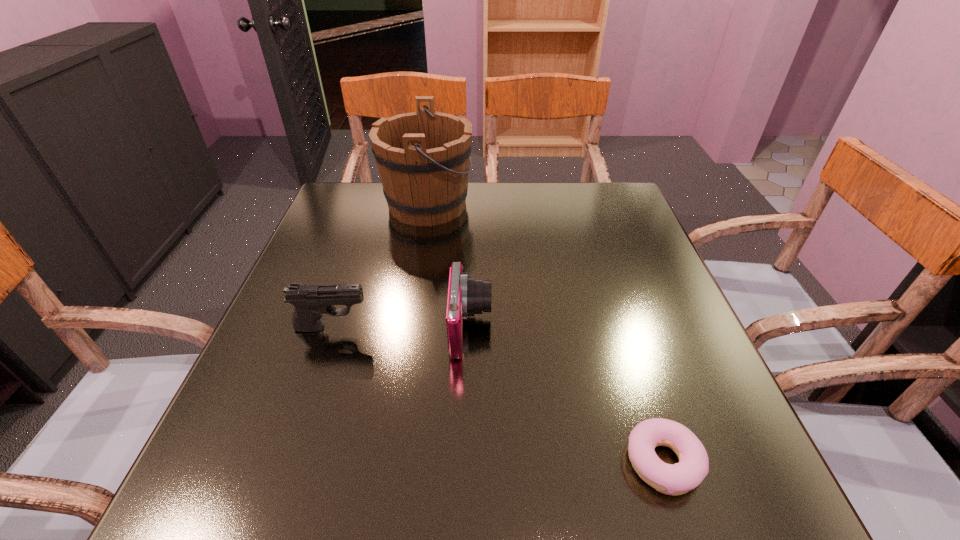
This screenshot has width=960, height=540. I want to click on vacant position in the image that satisfies the following two spatial constraints: 1. at the barrel of the shortest object; 2. on the left side of the pistol, so click(x=286, y=462).

Identify the location of vacant space that satisfies the following two spatial constraints: 1. on the front-facing side of the nearest object; 2. on the left side of the camera. This screenshot has width=960, height=540. (468, 462).

Image resolution: width=960 pixels, height=540 pixels. I want to click on free space that satisfies the following two spatial constraints: 1. at the barrel of the pistol; 2. on the right side of the nearest object, so click(x=286, y=462).

At what (x,y) coordinates should I click in order to perform the action: click on free space that satisfies the following two spatial constraints: 1. on the back side of the rightmost object; 2. on the side of the tallest object with the handle for carrying. Please return your answer as a coordinate pair (x, y). The height and width of the screenshot is (540, 960). Looking at the image, I should click on (580, 205).